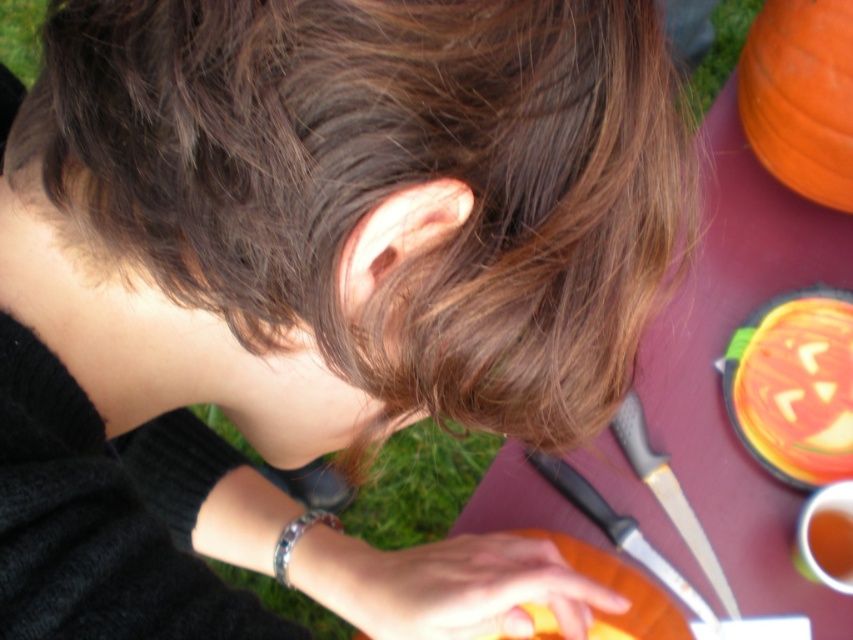
You are a photographer taking a picture of the orange matte pumpkin at upper right and the orange matte pumpkin at lower center. Which pumpkin should you focus on first if you want to capture both in the frame without moving the camera?

The orange matte pumpkin at upper right should be focused on first since it is above the orange matte pumpkin at lower center, allowing the camera to capture both in the frame by adjusting focus from top to bottom.

Based on the scene description, where is the orange carved pumpkin located? Please provide coordinates in the format of a point like point (793, 385).

The orange carved pumpkin at lower right is located at point (793, 385).

You are a photographer trying to capture both orange matte pumpkin at upper right and orange matte pumpkin at lower center in a single shot. Based on their positions, which pumpkin should you move forward to ensure both are fully visible in the frame?

The orange matte pumpkin at lower center is behind the orange matte pumpkin at upper right. To ensure both are fully visible, move the orange matte pumpkin at lower center forward so it is no longer obstructed by the one at upper right.